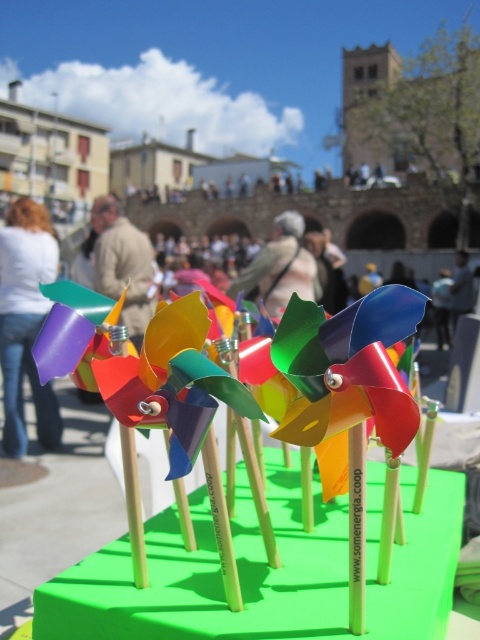
You are a tailor who needs to measure the distance between the matte purple tie at left and the light beige fabric at center. According to the image, how far apart are these two items?

The matte purple tie at left is 6.11 feet from the light beige fabric at center, so the distance between them is 6.11 feet.

Consider the image. You are standing in front of the pinwheel display and see both the light brown leather jacket at center and the light beige fabric at center. Which one is nearer to you?

The light brown leather jacket at center is closer to the viewer than the light beige fabric at center.

You are at an event where you need to locate the matte purple tie at left and the light brown leather jacket at center. Based on their positions, which one is closer to the ground?

The matte purple tie at left is located below the light brown leather jacket at center, so it is closer to the ground.